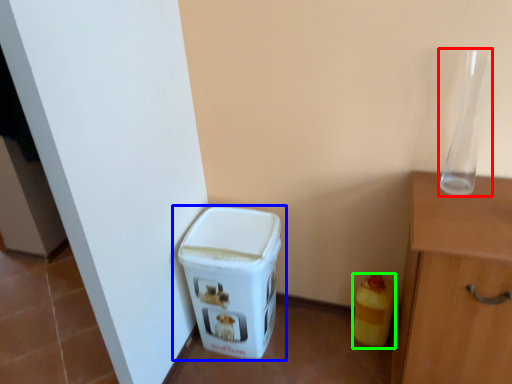
Question: Which object is positioned closest to glass vase (highlighted by a red box)? Select from waste container (highlighted by a blue box) and bottle (highlighted by a green box).

Choices:
 (A) waste container
 (B) bottle

Answer: (B)